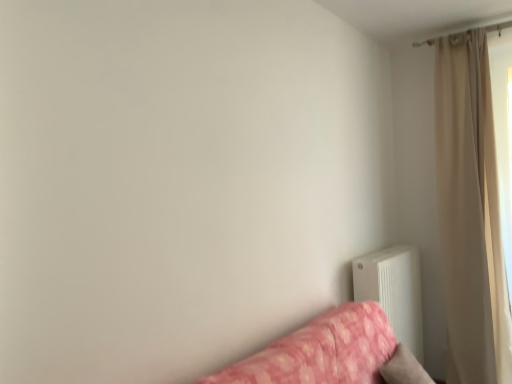
Question: From a real-world perspective, is pink floral fabric studio couch at lower right positioned above or below beige fabric curtain at upper right?

Choices:
 (A) below
 (B) above

Answer: (A)

Question: Is pink floral fabric studio couch at lower right taller or shorter than beige fabric curtain at upper right?

Choices:
 (A) short
 (B) tall

Answer: (A)

Question: Which object is the farthest from the pink floral fabric studio couch at lower right?

Choices:
 (A) white matte radiator at lower right
 (B) beige fabric curtain at upper right

Answer: (B)

Question: Estimate the real-world distances between objects in this image. Which object is farther from the pink floral fabric studio couch at lower right?

Choices:
 (A) beige fabric curtain at upper right
 (B) white matte radiator at lower right

Answer: (A)